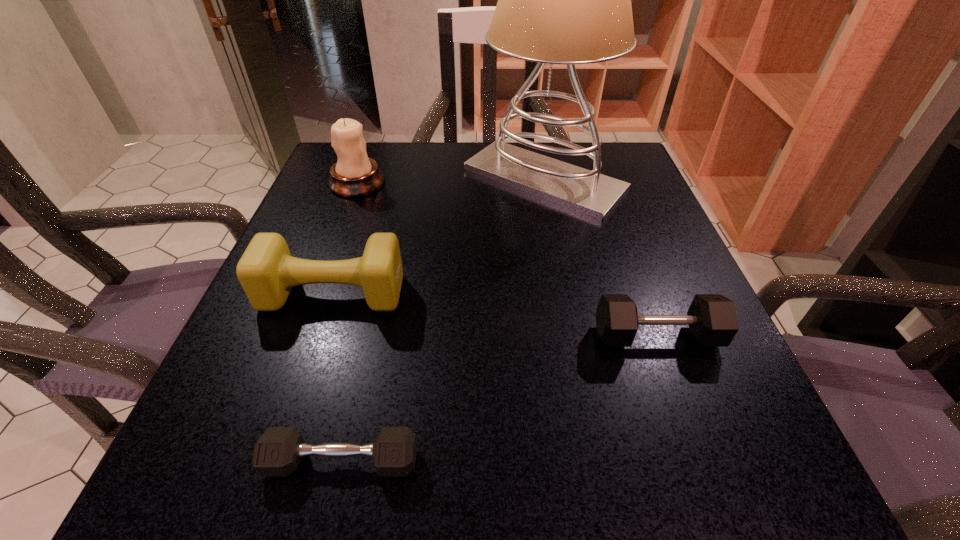
Image resolution: width=960 pixels, height=540 pixels. I want to click on object that is at the near left corner, so click(x=278, y=452).

The image size is (960, 540). What are the coordinates of `object at the far right corner` in the screenshot? It's located at (566, 0).

This screenshot has width=960, height=540. What are the coordinates of `blank space at the far edge of the desktop` in the screenshot? It's located at (469, 179).

You are a GUI agent. You are given a task and a screenshot of the screen. Output one action in this format:
    pyautogui.click(x=<x>, y=<y>)
    Task: Click on the vacant area at the left edge of the desktop
    
    Given the screenshot: What is the action you would take?
    pyautogui.click(x=344, y=233)

This screenshot has width=960, height=540. In order to click on free space at the right edge of the desktop in this screenshot , I will do coord(667,282).

The image size is (960, 540). In order to click on vacant space at the far right corner in this screenshot , I will do `click(600, 148)`.

Identify the location of empty space that is in between the shortest dumbbell and the second nearest dumbbell. This screenshot has height=540, width=960. (499, 399).

Find the location of a particular element. free space between the table lamp and the third nearest object is located at coordinates (439, 237).

The height and width of the screenshot is (540, 960). In order to click on empty space between the shortest dumbbell and the second shortest dumbbell in this screenshot , I will do `click(499, 399)`.

Find the location of `free space between the table lamp and the farthest dumbbell`. free space between the table lamp and the farthest dumbbell is located at coordinates (439, 237).